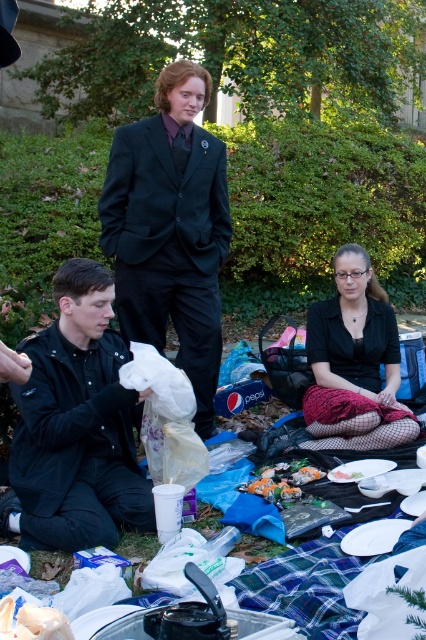
Between black matte suit at center and shiny plastic bag at lower center, which one has more height?

With more height is black matte suit at center.

Measure the distance between black matte suit at center and camera.

black matte suit at center is 4.15 meters from camera.

Image resolution: width=426 pixels, height=640 pixels. Find the location of `black matte suit at center`. black matte suit at center is located at coordinates (169, 244).

The width and height of the screenshot is (426, 640). I want to click on black matte suit at center, so point(169,244).

Is black matte jacket at lower left wider than black textured skirt at center?

No, black matte jacket at lower left is not wider than black textured skirt at center.

Can you confirm if black matte jacket at lower left is thinner than black textured skirt at center?

Yes, black matte jacket at lower left is thinner than black textured skirt at center.

Which is in front, point (63, 364) or point (336, 444)?

Positioned in front is point (63, 364).

The height and width of the screenshot is (640, 426). Identify the location of black matte jacket at lower left. (77, 424).

Between point (26, 339) and point (293, 460), which one is positioned in front?

Positioned in front is point (26, 339).

Is the position of black matte jacket at lower left more distant than that of shiny plastic bag at lower center?

No, it is in front of shiny plastic bag at lower center.

Where is `black matte jacket at lower left`? black matte jacket at lower left is located at coordinates (77, 424).

Identify the location of black matte jacket at lower left. (77, 424).